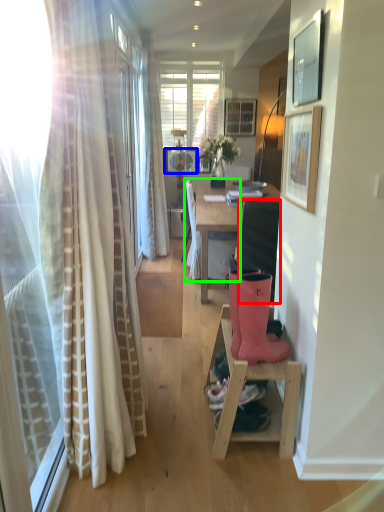
Question: Considering the real-world distances, which object is farthest from swivel chair (highlighted by a red box)? picture frame (highlighted by a blue box) or chair (highlighted by a green box)?

Choices:
 (A) picture frame
 (B) chair

Answer: (A)